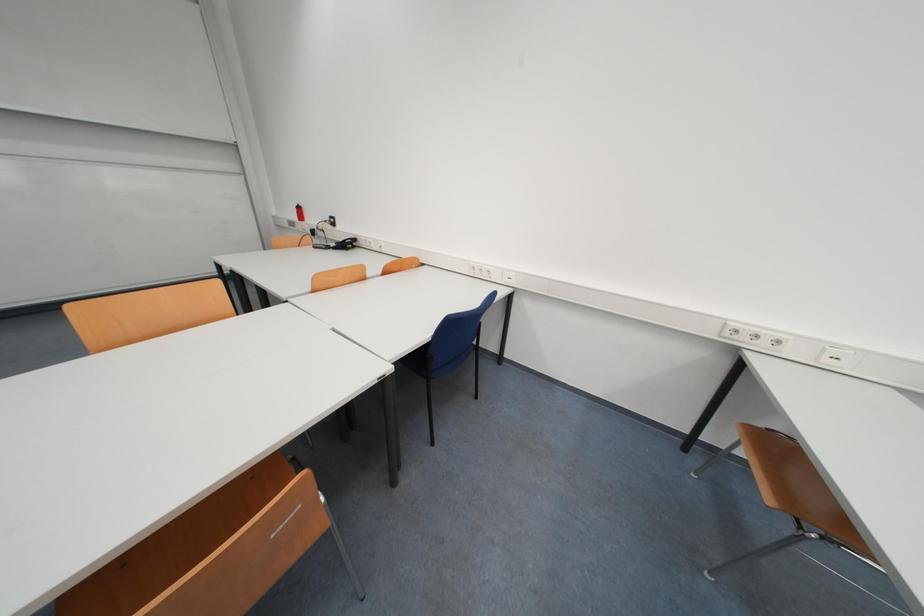
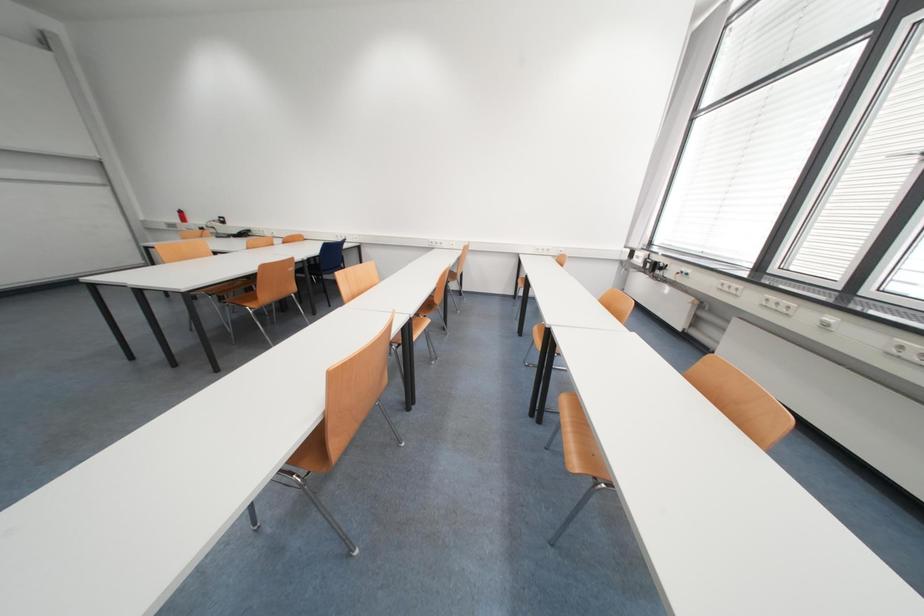
Question: Which direction would the cameraman need to move to produce the second image? Reply with the corresponding letter.

Choices:
 (A) Left
 (B) Right
 (C) Forward
 (D) Backward

Answer: (D)